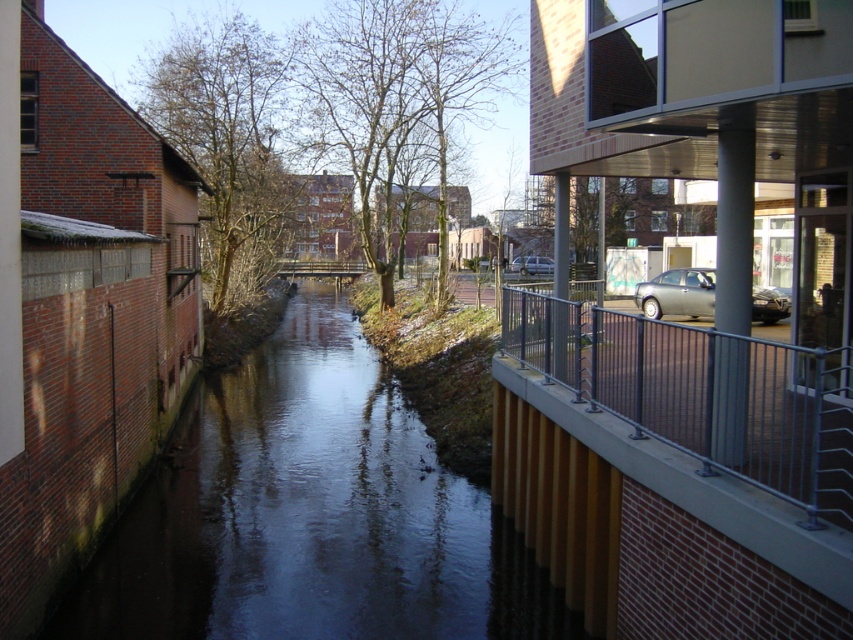
In the scene shown: Who is more forward, (398, 461) or (271, 237)?

Positioned in front is point (398, 461).

Does point (294, 579) lie behind point (225, 168)?

No, (294, 579) is closer to viewer.

Is point (321, 557) less distant than point (215, 140)?

That is True.

Locate an element on the screen. dark water at center is located at coordinates (312, 512).

Does metal/rail at right appear over brown leafy tree at upper left?

No, metal/rail at right is not above brown leafy tree at upper left.

Does point (788, 365) come farther from viewer compared to point (195, 52)?

No, (788, 365) is in front of (195, 52).

Who is more forward, (x=633, y=435) or (x=178, y=102)?

Point (x=633, y=435)

The image size is (853, 640). I want to click on metal/rail at right, so point(703,394).

Is bare branches at center thinner than brown leafy tree at upper left?

In fact, bare branches at center might be wider than brown leafy tree at upper left.

Does bare branches at center have a lesser height compared to brown leafy tree at upper left?

Indeed, bare branches at center has a lesser height compared to brown leafy tree at upper left.

This screenshot has width=853, height=640. Identify the location of bare branches at center. (396, 106).